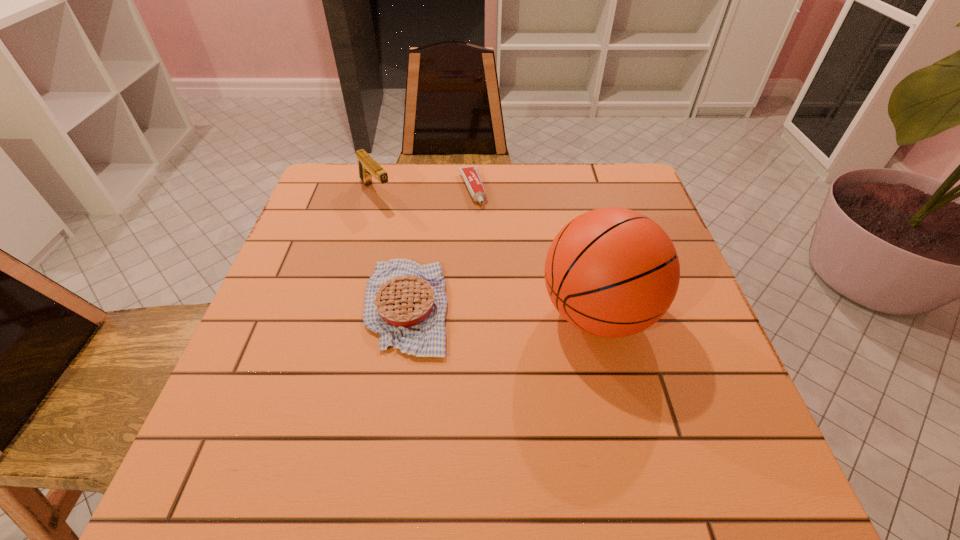
Find the location of `pie`. pie is located at coordinates (405, 302).

Identify the location of the tallest object. Image resolution: width=960 pixels, height=540 pixels. (612, 272).

Find the location of a particular element. This screenshot has width=960, height=540. the rightmost object is located at coordinates (612, 272).

Where is `pistol`? pistol is located at coordinates (368, 167).

Identify the location of the shortest object. (470, 174).

Locate an element on the screen. The image size is (960, 540). toothpaste is located at coordinates tap(470, 174).

Find the location of `vacant area situated on the left of the second shortest object`. vacant area situated on the left of the second shortest object is located at coordinates (330, 306).

Where is `vacant area located 0.260m on the back of the basketball`? The width and height of the screenshot is (960, 540). vacant area located 0.260m on the back of the basketball is located at coordinates point(571,204).

Find the location of a particular element. free region located 0.240m at the barrel of the pistol is located at coordinates (430, 255).

Find the location of a particular element. The height and width of the screenshot is (540, 960). vacant space situated at the barrel of the pistol is located at coordinates (461, 288).